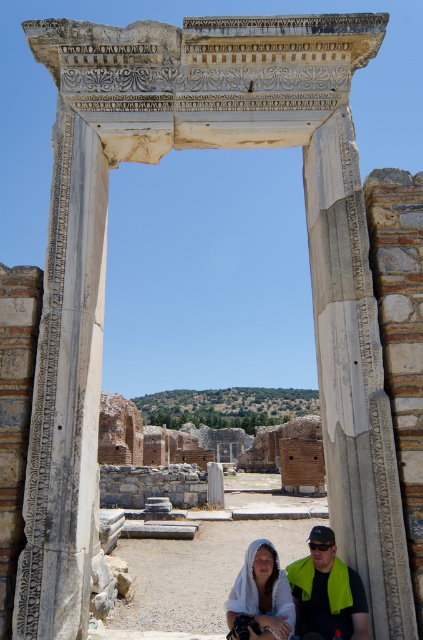
You are an archaeologist examining the ancient site. You need to place a marker at the exact center of the green fabric towel at lower center. What are the coordinates where you should place the marker?

The coordinates for the exact center of the green fabric towel at lower center are at point (327, 596).

You are at the archaeological site and want to place a small statue exactly at the point marked by point (327, 596). What object will the statue be placed next to?

The point (327, 596) marks the green fabric towel at lower center, so the statue will be placed next to the green fabric towel at lower center.

You are an archaeologist at the site and need to cover two artifacts with the available fabrics. The green fabric towel at lower center and the white cloth at center are both lying on the sandy ground. Which fabric should you use to cover a taller artifact?

The white cloth at center should be used to cover the taller artifact because it is taller than the green fabric towel at lower center.